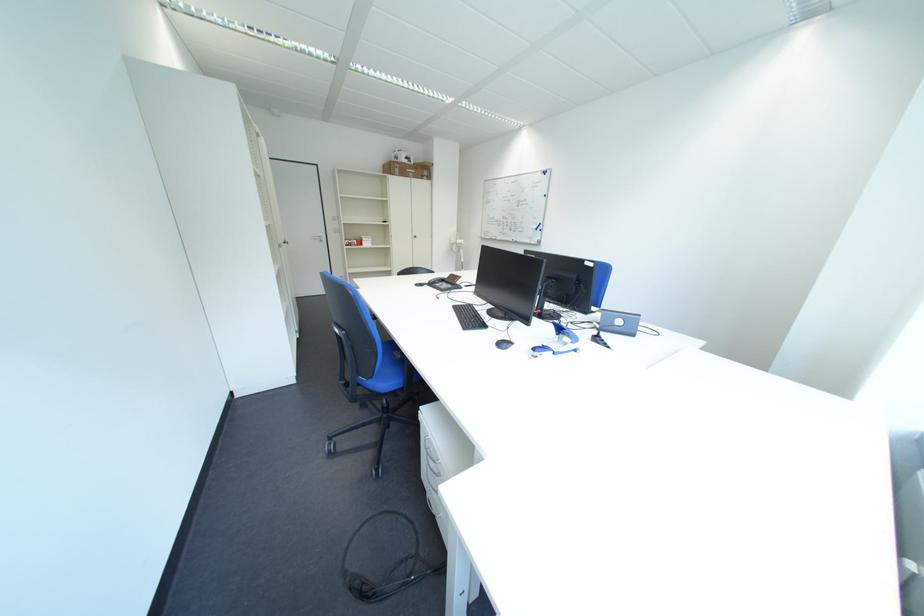
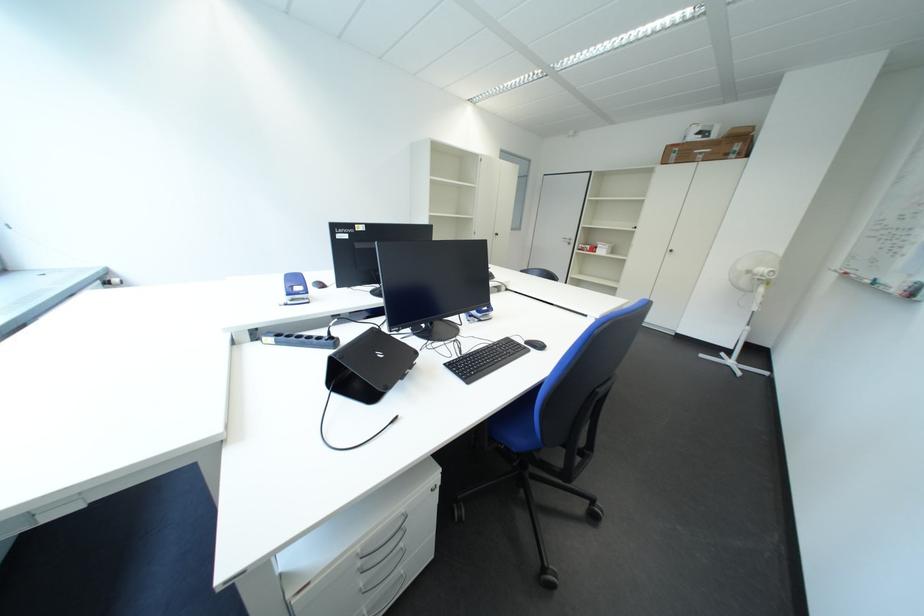
Find the pixel in the second image that matches (x=438, y=176) in the first image.

(748, 150)